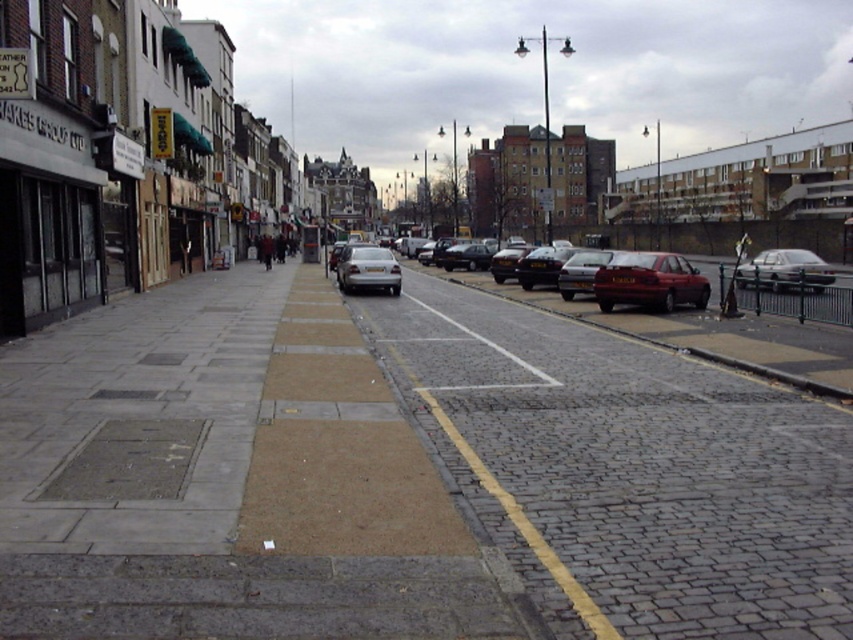
Question: Does brick paved road at center appear on the left side of shiny silver car at center?

Choices:
 (A) no
 (B) yes

Answer: (B)

Question: In this image, where is silver metallic sedan at right located relative to silver metallic sedan at center-right?

Choices:
 (A) right
 (B) left

Answer: (A)

Question: Which point is farther from the camera taking this photo?

Choices:
 (A) (502, 259)
 (B) (555, 257)
 (C) (575, 285)
 (D) (664, 259)

Answer: (A)

Question: Among these objects, which one is nearest to the camera?

Choices:
 (A) brick paved road at center
 (B) matte red car at center
 (C) silver metallic sedan at center
 (D) silver metallic sedan at center-right

Answer: (A)

Question: Which of the following is the farthest from the observer?

Choices:
 (A) (503, 280)
 (B) (561, 292)

Answer: (A)

Question: Can you confirm if matte red car at center is positioned to the right of shiny silver car at center?

Choices:
 (A) no
 (B) yes

Answer: (B)